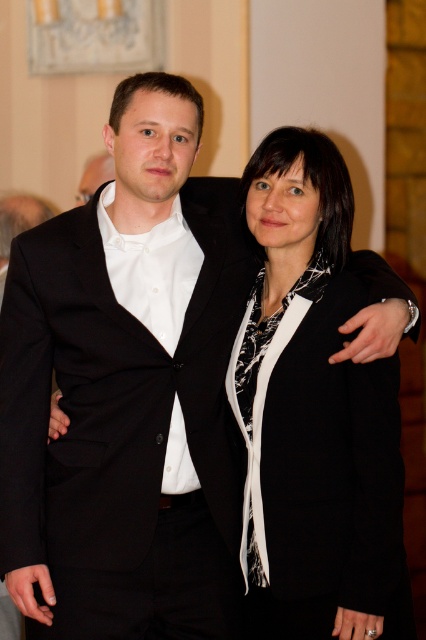
Question: Which point is closer to the camera?

Choices:
 (A) black matte blazer at center
 (B) black woolen suit at left

Answer: (A)

Question: Which point is closer to the camera?

Choices:
 (A) black matte blazer at center
 (B) black woolen suit at left

Answer: (A)

Question: Is black woolen suit at left to the left of black matte blazer at center from the viewer's perspective?

Choices:
 (A) no
 (B) yes

Answer: (B)

Question: Can you confirm if black woolen suit at left is positioned above black matte blazer at center?

Choices:
 (A) yes
 (B) no

Answer: (B)

Question: Which point is closer to the camera taking this photo?

Choices:
 (A) (46, 630)
 (B) (396, 433)

Answer: (B)

Question: In this image, where is black woolen suit at left located relative to black matte blazer at center?

Choices:
 (A) left
 (B) right

Answer: (A)